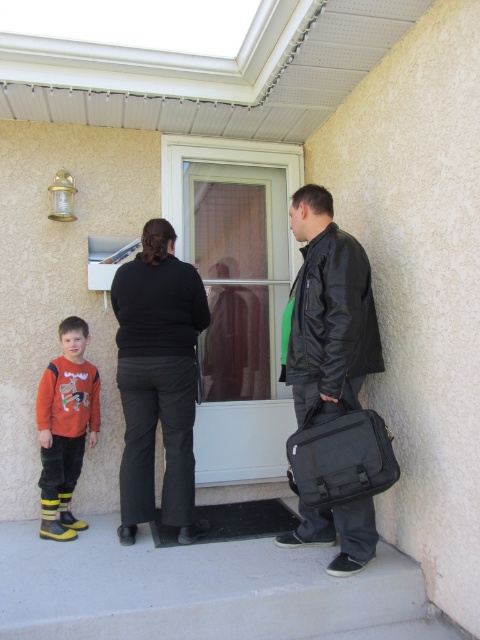
Can you confirm if black leather jacket at right is positioned to the left of orange cotton sweater at left?

In fact, black leather jacket at right is to the right of orange cotton sweater at left.

This screenshot has height=640, width=480. I want to click on black leather jacket at right, so click(327, 310).

Does black matte pants at center appear under black leather jacket at right?

Correct, black matte pants at center is located below black leather jacket at right.

Is point (175, 388) farther from viewer compared to point (334, 227)?

Yes, it is behind point (334, 227).

Find the location of a particular element. The image size is (480, 640). black matte pants at center is located at coordinates (157, 380).

Is black matte pants at center positioned behind orange cotton sweater at left?

No.

Which is behind, point (180, 435) or point (60, 452)?

The point (60, 452) is behind.

Identify the location of black matte pants at center. (157, 380).